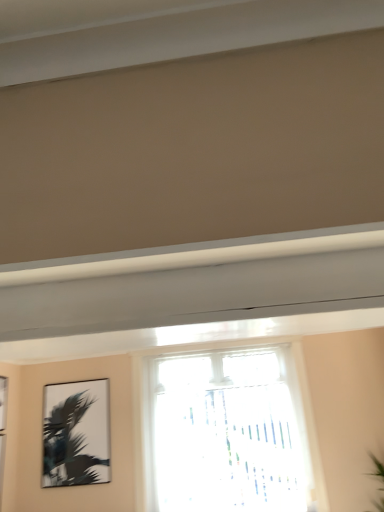
What do you see at coordinates (68, 445) in the screenshot? I see `silvery metallic palm tree at upper left` at bounding box center [68, 445].

This screenshot has height=512, width=384. Identify the location of silvery metallic palm tree at upper left. (68, 445).

The width and height of the screenshot is (384, 512). What do you see at coordinates (226, 430) in the screenshot? I see `transparent glass window at center` at bounding box center [226, 430].

The width and height of the screenshot is (384, 512). Identify the location of transparent glass window at center. (226, 430).

Locate an element on the screen. silvery metallic palm tree at upper left is located at coordinates (68, 445).

Between transparent glass window at center and silvery metallic palm tree at upper left, which one appears on the left side from the viewer's perspective?

silvery metallic palm tree at upper left is more to the left.

Is transparent glass window at center in front of or behind silvery metallic palm tree at upper left in the image?

transparent glass window at center is positioned closer to the viewer than silvery metallic palm tree at upper left.

Does point (249, 465) come closer to viewer compared to point (52, 433)?

That is False.

From the image's perspective, would you say transparent glass window at center is shown under silvery metallic palm tree at upper left?

No, from the image's perspective, transparent glass window at center is not beneath silvery metallic palm tree at upper left.

From a real-world perspective, which object stands above the other?

silvery metallic palm tree at upper left is physically above.

Which object is thinner, transparent glass window at center or silvery metallic palm tree at upper left?

silvery metallic palm tree at upper left is thinner.

Is transparent glass window at center taller than silvery metallic palm tree at upper left?

Yes, transparent glass window at center is taller than silvery metallic palm tree at upper left.

Considering the sizes of objects transparent glass window at center and silvery metallic palm tree at upper left in the image provided, who is bigger, transparent glass window at center or silvery metallic palm tree at upper left?

transparent glass window at center is bigger.

Is transparent glass window at center located outside silvery metallic palm tree at upper left?

Yes, transparent glass window at center is located beyond the bounds of silvery metallic palm tree at upper left.

Is transparent glass window at center positioned far away from silvery metallic palm tree at upper left?

Yes, transparent glass window at center and silvery metallic palm tree at upper left are quite far apart.

Is transparent glass window at center oriented towards silvery metallic palm tree at upper left?

No, transparent glass window at center is not facing towards silvery metallic palm tree at upper left.

How different are the orientations of transparent glass window at center and silvery metallic palm tree at upper left in degrees?

The angle between the facing direction of transparent glass window at center and the facing direction of silvery metallic palm tree at upper left is 0.38 degrees.

You are a GUI agent. You are given a task and a screenshot of the screen. Output one action in this format:
    pyautogui.click(x=<x>, y=<y>)
    Task: Click on the palm tree below the transparent glass window at center (from the image's perspective)
    Image resolution: width=384 pixels, height=512 pixels.
    Given the screenshot: What is the action you would take?
    pyautogui.click(x=68, y=445)

Is silvery metallic palm tree at upper left at the right side of transparent glass window at center?

Incorrect, silvery metallic palm tree at upper left is not on the right side of transparent glass window at center.

In the image, is silvery metallic palm tree at upper left positioned in front of or behind transparent glass window at center?

Visually, silvery metallic palm tree at upper left is located behind transparent glass window at center.

Is point (50, 445) closer or farther from the camera than point (314, 477)?

Clearly, point (50, 445) is more distant from the camera than point (314, 477).

In the scene shown: From the image's perspective, which is below, silvery metallic palm tree at upper left or transparent glass window at center?

silvery metallic palm tree at upper left is shown below in the image.

From a real-world perspective, between silvery metallic palm tree at upper left and transparent glass window at center, who is vertically higher?

In real-world perspective, silvery metallic palm tree at upper left is above.

Which object is wider, silvery metallic palm tree at upper left or transparent glass window at center?

Wider between the two is transparent glass window at center.

Which of these two, silvery metallic palm tree at upper left or transparent glass window at center, stands shorter?

silvery metallic palm tree at upper left.

Is silvery metallic palm tree at upper left bigger or smaller than transparent glass window at center?

silvery metallic palm tree at upper left is smaller than transparent glass window at center.

Is silvery metallic palm tree at upper left not within transparent glass window at center?

Yes, silvery metallic palm tree at upper left is not within transparent glass window at center.

Is silvery metallic palm tree at upper left far from transparent glass window at center?

Yes, silvery metallic palm tree at upper left is far from transparent glass window at center.

Is silvery metallic palm tree at upper left turned away from transparent glass window at center?

silvery metallic palm tree at upper left is not turned away from transparent glass window at center.

Can you tell me how much silvery metallic palm tree at upper left and transparent glass window at center differ in facing direction?

The angular difference between silvery metallic palm tree at upper left and transparent glass window at center is 0.38 degrees.

How much distance is there between silvery metallic palm tree at upper left and transparent glass window at center?

silvery metallic palm tree at upper left is 1.10 meters away from transparent glass window at center.

Find the location of `window in front of the silvery metallic palm tree at upper left`. window in front of the silvery metallic palm tree at upper left is located at coordinates (226, 430).

The width and height of the screenshot is (384, 512). What are the coordinates of `palm tree above the transparent glass window at center (from a real-world perspective)` in the screenshot? It's located at (68, 445).

Find the location of a particular element. window below the silvery metallic palm tree at upper left (from a real-world perspective) is located at coordinates (226, 430).